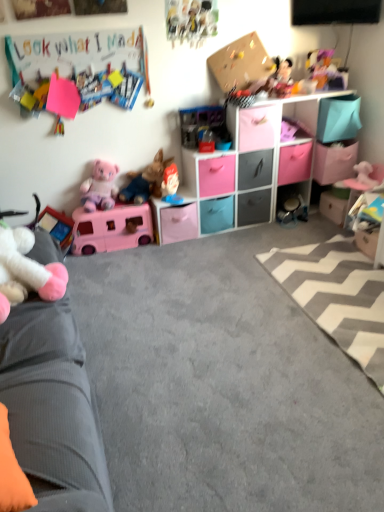
You are a GUI agent. You are given a task and a screenshot of the screen. Output one action in this format:
    pyautogui.click(x=<x>, y=<y>)
    Task: Click on the free location in front of gray matte drawer at center, placed as the 2th drawer when sorted from right to left
    The image size is (384, 512).
    Given the screenshot: What is the action you would take?
    pyautogui.click(x=254, y=237)